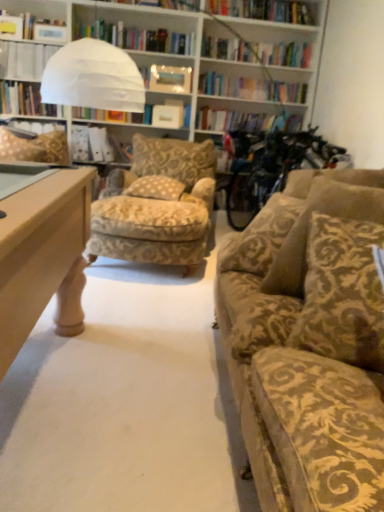
Question: From a real-world perspective, does white paper bag at center, which is the 1th book from right to left, stand above white paper at upper left, marked as the first book in a left-to-right arrangement?

Choices:
 (A) yes
 (B) no

Answer: (B)

Question: From a real-world perspective, is white paper bag at center, which ranks as the second book in top-to-bottom order, positioned under white paper at upper left, positioned as the 2th book in bottom-to-top order, based on gravity?

Choices:
 (A) no
 (B) yes

Answer: (B)

Question: From the image's perspective, is white paper bag at center, which ranks as the 1th book in bottom-to-top order, on white paper at upper left, marked as the first book in a left-to-right arrangement?

Choices:
 (A) no
 (B) yes

Answer: (A)

Question: Is white paper bag at center, which ranks as the second book in top-to-bottom order, oriented away from white paper at upper left, positioned as the 2th book in bottom-to-top order?

Choices:
 (A) yes
 (B) no

Answer: (B)

Question: Can you confirm if white paper bag at center, which is the 1th book from right to left, is shorter than white paper at upper left, marked as the first book in a left-to-right arrangement?

Choices:
 (A) no
 (B) yes

Answer: (A)

Question: Can you confirm if white paper bag at center, which ranks as the 1th book in bottom-to-top order, is smaller than white paper at upper left, marked as the first book in a left-to-right arrangement?

Choices:
 (A) no
 (B) yes

Answer: (A)

Question: Does brown textured pillow at right, placed as the 4th pillow when sorted from back to front, have a lesser width compared to velvet gold-patterned couch at right?

Choices:
 (A) no
 (B) yes

Answer: (B)

Question: From the image's perspective, is brown textured pillow at right, which is the 1th pillow from front to back, below velvet gold-patterned couch at right?

Choices:
 (A) yes
 (B) no

Answer: (A)

Question: Can you confirm if brown textured pillow at right, placed as the 4th pillow when sorted from back to front, is wider than velvet gold-patterned couch at right?

Choices:
 (A) yes
 (B) no

Answer: (B)

Question: From the image's perspective, is brown textured pillow at right, which is the 1th pillow from front to back, on top of velvet gold-patterned couch at right?

Choices:
 (A) no
 (B) yes

Answer: (A)

Question: Considering the relative sizes of brown textured pillow at right, marked as the 2th pillow in a right-to-left arrangement, and velvet gold-patterned couch at right in the image provided, is brown textured pillow at right, marked as the 2th pillow in a right-to-left arrangement, smaller than velvet gold-patterned couch at right?

Choices:
 (A) no
 (B) yes

Answer: (B)

Question: Is brown textured pillow at right, placed as the 4th pillow when sorted from back to front, not close to velvet gold-patterned couch at right?

Choices:
 (A) yes
 (B) no

Answer: (B)

Question: Is beige damask pillow at center, the 2th pillow viewed from the back, facing away from brown textured pillow at right, which is counted as the third pillow, starting from the left?

Choices:
 (A) yes
 (B) no

Answer: (B)